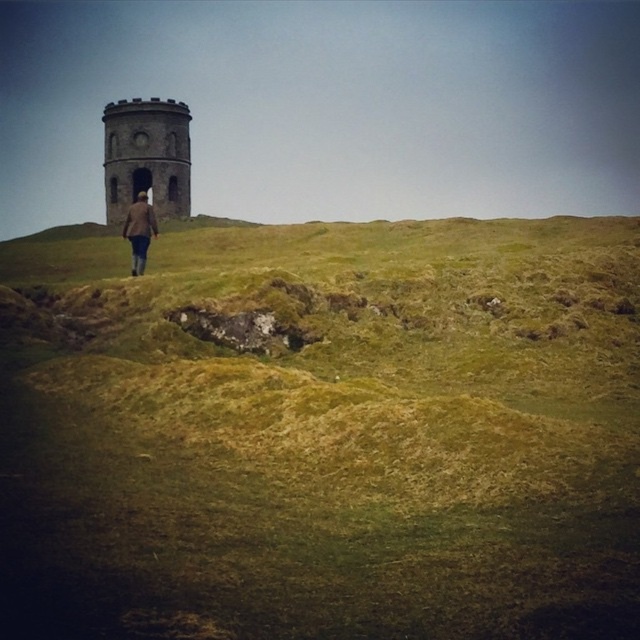
You are standing at the base of the green grassy hillside at center. If you walk straight ahead, will you reach the cylindrical stone tower in the background?

The green grassy hillside at center is located at point (323, 433), which suggests it is positioned towards the center of the image. Since the tower is in the background and the person is walking towards it, walking straight ahead from the hillside would lead towards the tower. Therefore, yes, you would reach the cylindrical stone tower in the background.

You are standing at the base of the green grassy hillside at center and want to reach the brown woolen coat at center. Which direction should you walk to get closer to the coat?

The green grassy hillside at center is positioned under the brown woolen coat at center, so you should walk upwards to reach the coat.

You are standing at the base of the green grassy hillside at center and want to walk to the brown woolen coat at center. Which direction should you head?

The green grassy hillside at center is to the right of the brown woolen coat at center, so you should head to the left to reach it.